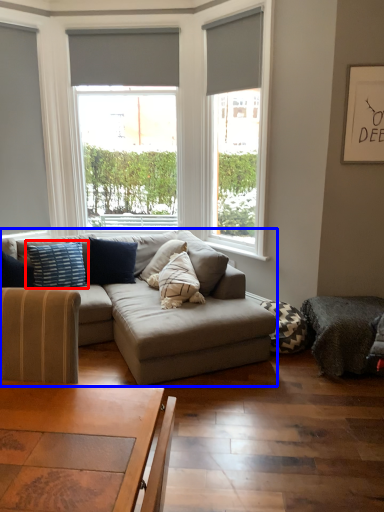
Question: Which object is further to the camera taking this photo, pillow (highlighted by a red box) or studio couch (highlighted by a blue box)?

Choices:
 (A) pillow
 (B) studio couch

Answer: (A)